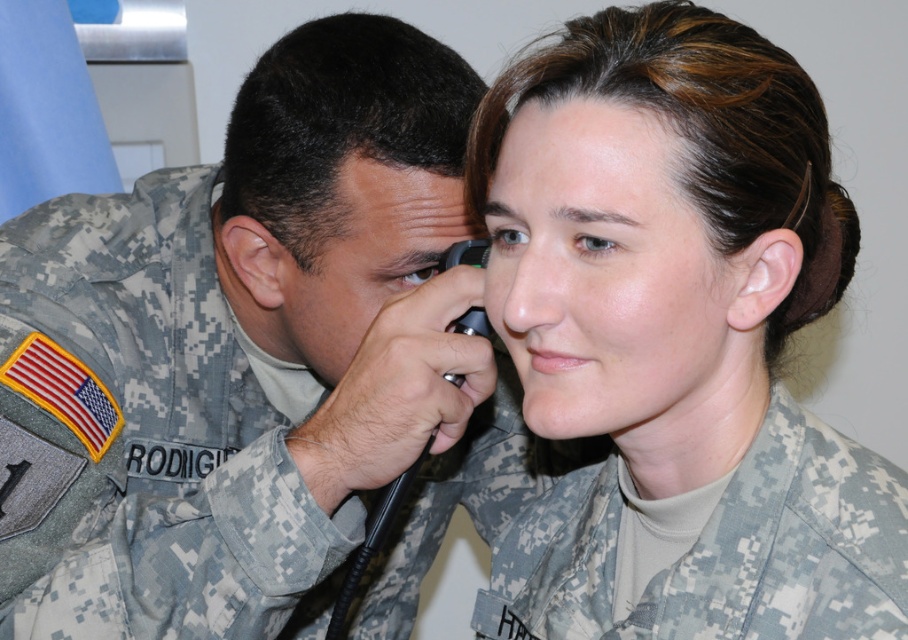
You are a photographer standing 22.64 inches away from the camouflage fabric uniform at center. You want to take a photo of the uniform without including the camera in the frame. Is this possible?

The camouflage fabric uniform at center and camera are 22.64 inches apart, so yes, you can take a photo of the camouflage fabric uniform at center without including the camera in the frame by positioning yourself appropriately.

Based on the scene described, where is the camouflage uniform at left located in terms of its 2D coordinates?

The camouflage uniform at left is located at the 2D coordinates of point (243, 369).